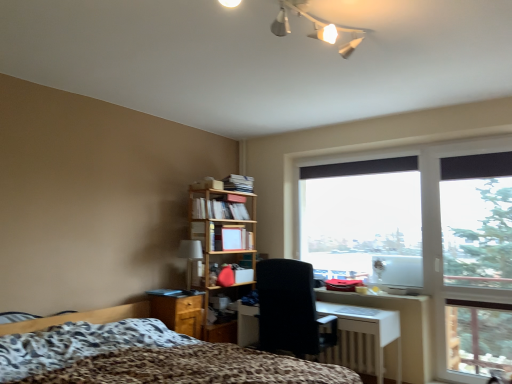
Describe the element at coordinates (290, 309) in the screenshot. I see `black fabric chair at center` at that location.

Where is `matte wooden bookshelf at center`? This screenshot has width=512, height=384. matte wooden bookshelf at center is located at coordinates (219, 210).

What is the approximate width of white glossy desk at center?

The width of white glossy desk at center is 21.71 inches.

What do you see at coordinates (362, 338) in the screenshot? I see `white glossy desk at center` at bounding box center [362, 338].

I want to click on black fabric chair at center, so click(x=290, y=309).

Is wooden/file cabinet at lower left far from black fabric chair at center?

They are positioned close to each other.

Does point (155, 311) come farther from viewer compared to point (298, 339)?

Yes, point (155, 311) is behind point (298, 339).

In the image, is wooden/file cabinet at lower left positioned in front of or behind black fabric chair at center?

wooden/file cabinet at lower left is behind black fabric chair at center.

Which object is positioned more to the left, wooden/file cabinet at lower left or black fabric chair at center?

From the viewer's perspective, wooden/file cabinet at lower left appears more on the left side.

Can you tell me how much matte beige table lamp at center-left and wooden/file cabinet at lower left differ in facing direction?

0.00103 degrees.

In the image, there is a matte beige table lamp at center-left. Where is `file cabinet below it (from the image's perspective)`? Image resolution: width=512 pixels, height=384 pixels. file cabinet below it (from the image's perspective) is located at coordinates (178, 313).

From the image's perspective, between matte beige table lamp at center-left and wooden/file cabinet at lower left, which one is located above?

From the image's view, matte beige table lamp at center-left is above.

Does point (190, 266) come in front of point (195, 337)?

No.

Does matte beige table lamp at center-left appear on the left side of leopard print fabric bed at lower left?

In fact, matte beige table lamp at center-left is to the right of leopard print fabric bed at lower left.

From the image's perspective, is matte beige table lamp at center-left beneath leopard print fabric bed at lower left?

Incorrect, from the image's perspective, matte beige table lamp at center-left is higher than leopard print fabric bed at lower left.

Considering the sizes of matte beige table lamp at center-left and leopard print fabric bed at lower left in the image, is matte beige table lamp at center-left wider or thinner than leopard print fabric bed at lower left?

In the image, matte beige table lamp at center-left appears to be more narrow than leopard print fabric bed at lower left.

Could leopard print fabric bed at lower left be considered to be inside matte beige table lamp at center-left?

No, matte beige table lamp at center-left does not contain leopard print fabric bed at lower left.

Is white glossy desk at center at the right side of matte beige table lamp at center-left?

Correct, you'll find white glossy desk at center to the right of matte beige table lamp at center-left.

How many degrees apart are the facing directions of white glossy desk at center and matte beige table lamp at center-left?

92.7 degrees.

Who is shorter, white glossy desk at center or matte beige table lamp at center-left?

matte beige table lamp at center-left is shorter.

Can you confirm if white glossy desk at center is bigger than matte beige table lamp at center-left?

Indeed, white glossy desk at center has a larger size compared to matte beige table lamp at center-left.

Is black fabric chair at center next to wooden/file cabinet at lower left?

black fabric chair at center is not next to wooden/file cabinet at lower left, and they're not touching.

Is black fabric chair at center in front of or behind wooden/file cabinet at lower left in the image?

In the image, black fabric chair at center appears in front of wooden/file cabinet at lower left.

Is black fabric chair at center turned away from wooden/file cabinet at lower left?

That's not correct — black fabric chair at center is not looking away from wooden/file cabinet at lower left.

Can you confirm if black fabric chair at center is bigger than wooden/file cabinet at lower left?

Yes.

From the picture: How different are the orientations of white glossy desk at center and leopard print fabric bed at lower left in degrees?

white glossy desk at center and leopard print fabric bed at lower left are facing 88.3 degrees away from each other.

Considering the positions of objects white glossy desk at center and leopard print fabric bed at lower left in the image provided, who is more to the right, white glossy desk at center or leopard print fabric bed at lower left?

From the viewer's perspective, white glossy desk at center appears more on the right side.

Is white glossy desk at center further to the viewer compared to leopard print fabric bed at lower left?

Yes, white glossy desk at center is further from the viewer.

Is leopard print fabric bed at lower left positioned beyond the bounds of transparent glass window at center?

Absolutely, leopard print fabric bed at lower left is external to transparent glass window at center.

How many degrees apart are the facing directions of leopard print fabric bed at lower left and transparent glass window at center?

They differ by 89.3 degrees in their facing directions.

This screenshot has height=384, width=512. In order to click on bed located below the transparent glass window at center (from the image's perspective) in this screenshot , I will do `click(143, 354)`.

From the image's perspective, is leopard print fabric bed at lower left on transparent glass window at center?

Actually, leopard print fabric bed at lower left appears below transparent glass window at center in the image.

Where is `file cabinet that is on the left side of black fabric chair at center`? This screenshot has height=384, width=512. file cabinet that is on the left side of black fabric chair at center is located at coordinates (178, 313).

The width and height of the screenshot is (512, 384). I want to click on table lamp above the wooden/file cabinet at lower left (from the image's perspective), so click(x=190, y=255).

Considering their positions, is white glossy desk at center positioned closer to black fabric chair at center than matte wooden bookshelf at center?

white glossy desk at center is positioned closer to the anchor black fabric chair at center.

In the scene shown: When comparing their distances from black fabric chair at center, does matte beige table lamp at center-left or leopard print fabric bed at lower left seem further?

Among the two, matte beige table lamp at center-left is located further to black fabric chair at center.

Based on the photo, when comparing their distances from wooden/file cabinet at lower left, does leopard print fabric bed at lower left or transparent glass window at center seem further?

Among the two, transparent glass window at center is located further to wooden/file cabinet at lower left.

Considering their positions, is matte beige table lamp at center-left positioned further to leopard print fabric bed at lower left than black fabric chair at center?

matte beige table lamp at center-left lies further to leopard print fabric bed at lower left than the other object.

When comparing their distances from wooden/file cabinet at lower left, does white glossy desk at center or transparent glass window at center seem further?

transparent glass window at center is further to wooden/file cabinet at lower left.

Based on their spatial positions, is transparent glass window at center or black fabric chair at center further from wooden/file cabinet at lower left?

Among the two, transparent glass window at center is located further to wooden/file cabinet at lower left.

Based on their spatial positions, is matte beige table lamp at center-left or black fabric chair at center further from matte wooden bookshelf at center?

Among the two, black fabric chair at center is located further to matte wooden bookshelf at center.

Based on the photo, when comparing their distances from transparent glass window at center, does black fabric chair at center or matte beige table lamp at center-left seem closer?

black fabric chair at center lies closer to transparent glass window at center than the other object.

At what (x,y) coordinates should I click in order to perform the action: click on chair between leopard print fabric bed at lower left and matte wooden bookshelf at center in the front-back direction. Please return your answer as a coordinate pair (x, y). Image resolution: width=512 pixels, height=384 pixels. Looking at the image, I should click on (290, 309).

Identify the location of table lamp between wooden/file cabinet at lower left and transparent glass window at center in the horizontal direction. (190, 255).

Locate an element on the screen. desk located between leopard print fabric bed at lower left and matte beige table lamp at center-left in the depth direction is located at coordinates (362, 338).

I want to click on table lamp located between wooden/file cabinet at lower left and white glossy desk at center in the left-right direction, so click(x=190, y=255).